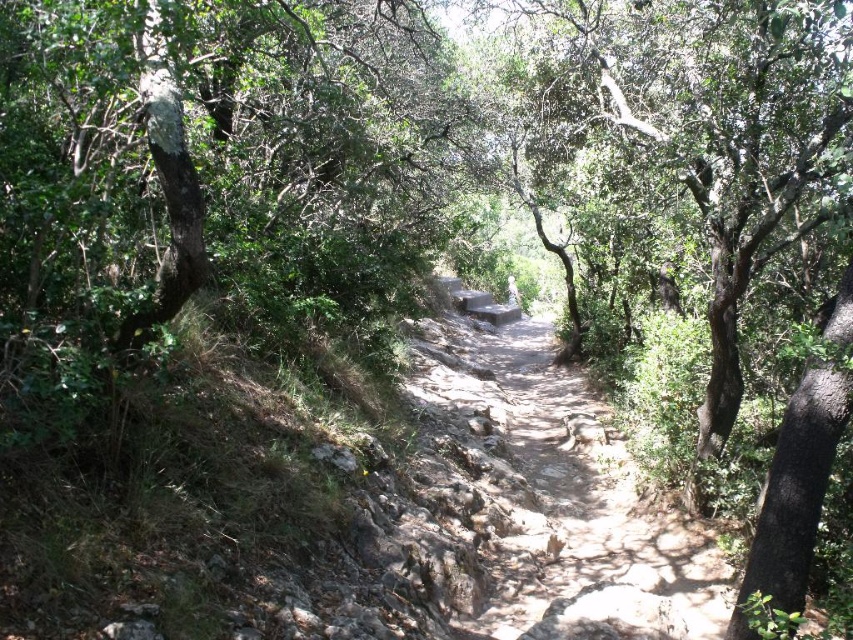
Does green leafy tree at center have a greater height compared to dirt path at center?

Yes.

Describe the element at coordinates (724, 134) in the screenshot. I see `green leafy tree at center` at that location.

Measure the distance between green leafy tree at center and camera.

The distance of green leafy tree at center from camera is 3.50 meters.

I want to click on green leafy tree at center, so click(724, 134).